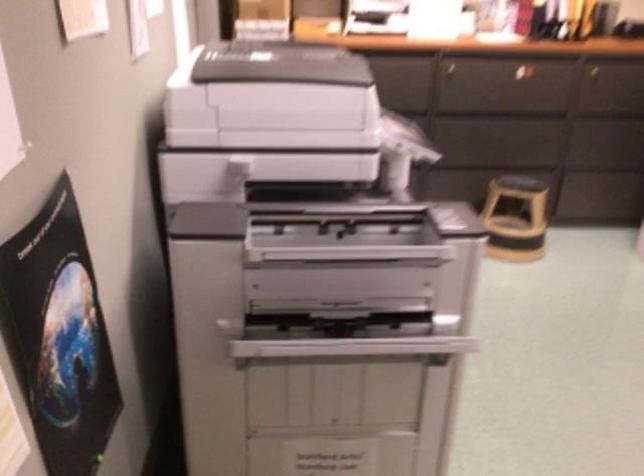
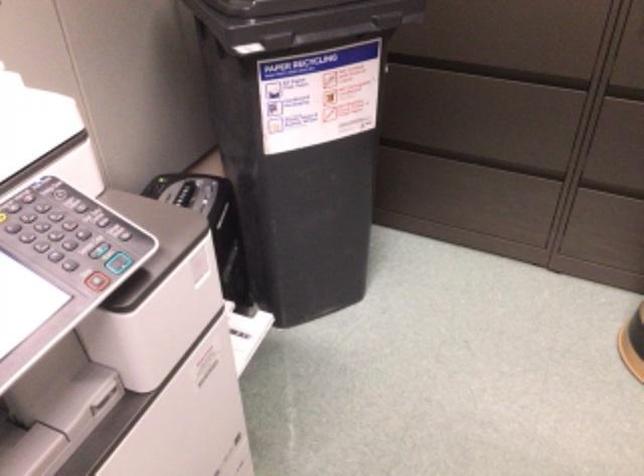
Where in the second image is the point corresponding to the point at 459,161 from the first image?

(614, 180)